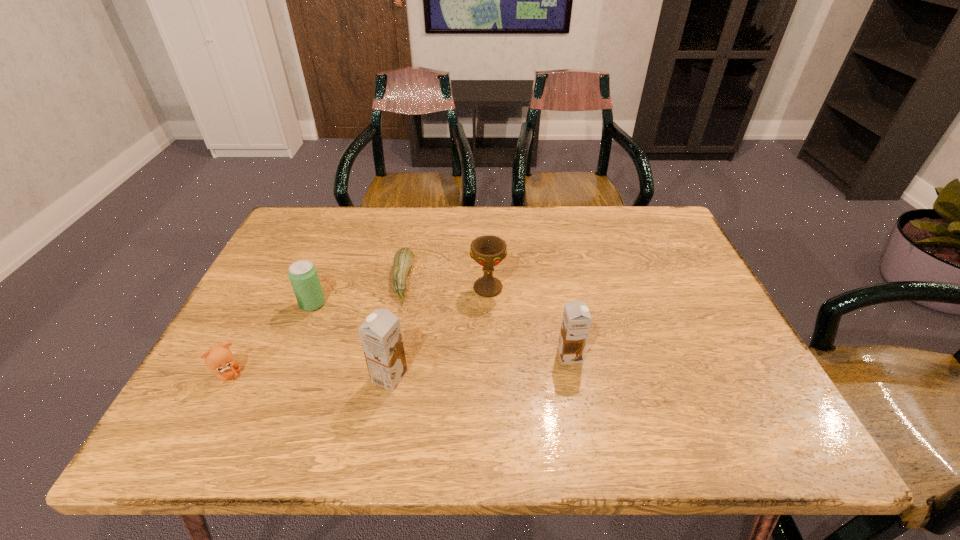
In order to click on vacant place for an extra chocolate milk on the right in this screenshot , I will do `click(734, 335)`.